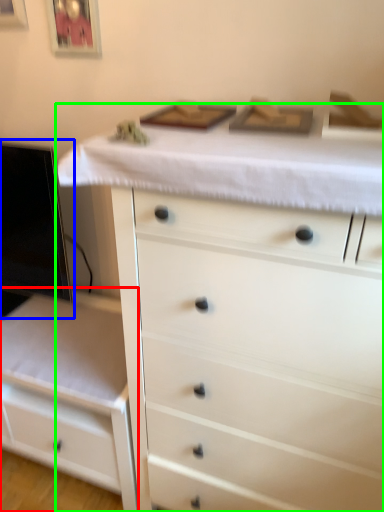
Question: Which is nearer to the chest of drawers (highlighted by a red box)? computer monitor (highlighted by a blue box) or chest of drawers (highlighted by a green box).

Choices:
 (A) computer monitor
 (B) chest of drawers

Answer: (A)